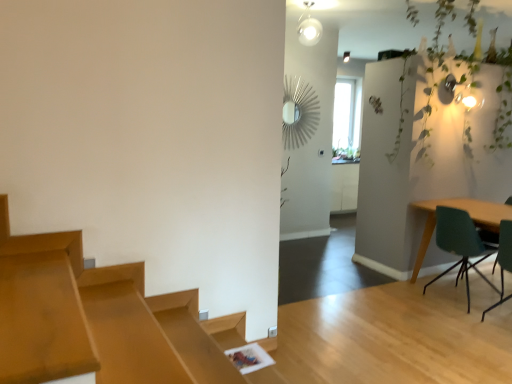
Question: From the image's perspective, is green leafy plant at upper right below teal fabric chair at right?

Choices:
 (A) no
 (B) yes

Answer: (A)

Question: Is green leafy plant at upper right further to the viewer compared to teal fabric chair at right?

Choices:
 (A) no
 (B) yes

Answer: (A)

Question: Is green leafy plant at upper right to the right of teal fabric chair at right from the viewer's perspective?

Choices:
 (A) no
 (B) yes

Answer: (A)

Question: From a real-world perspective, is green leafy plant at upper right located higher than teal fabric chair at right?

Choices:
 (A) no
 (B) yes

Answer: (B)

Question: Does green leafy plant at upper right have a greater width compared to teal fabric chair at right?

Choices:
 (A) yes
 (B) no

Answer: (B)

Question: Can you confirm if green leafy plant at upper right is taller than teal fabric chair at right?

Choices:
 (A) no
 (B) yes

Answer: (B)

Question: Is the depth of teal fabric chair at right greater than that of green leafy plant at upper right?

Choices:
 (A) no
 (B) yes

Answer: (B)

Question: Is teal fabric chair at right located outside green leafy plant at upper right?

Choices:
 (A) no
 (B) yes

Answer: (B)

Question: Is teal fabric chair at right taller than green leafy plant at upper right?

Choices:
 (A) no
 (B) yes

Answer: (A)

Question: Is teal fabric chair at right at the left side of green leafy plant at upper right?

Choices:
 (A) yes
 (B) no

Answer: (B)

Question: Is teal fabric chair at right in contact with green leafy plant at upper right?

Choices:
 (A) yes
 (B) no

Answer: (B)

Question: Is teal fabric chair at right oriented towards green leafy plant at upper right?

Choices:
 (A) no
 (B) yes

Answer: (A)

Question: Can you confirm if teal fabric chair at right is taller than teal matte chair at right, which ranks as the 2th chair in front-to-back order?

Choices:
 (A) no
 (B) yes

Answer: (B)